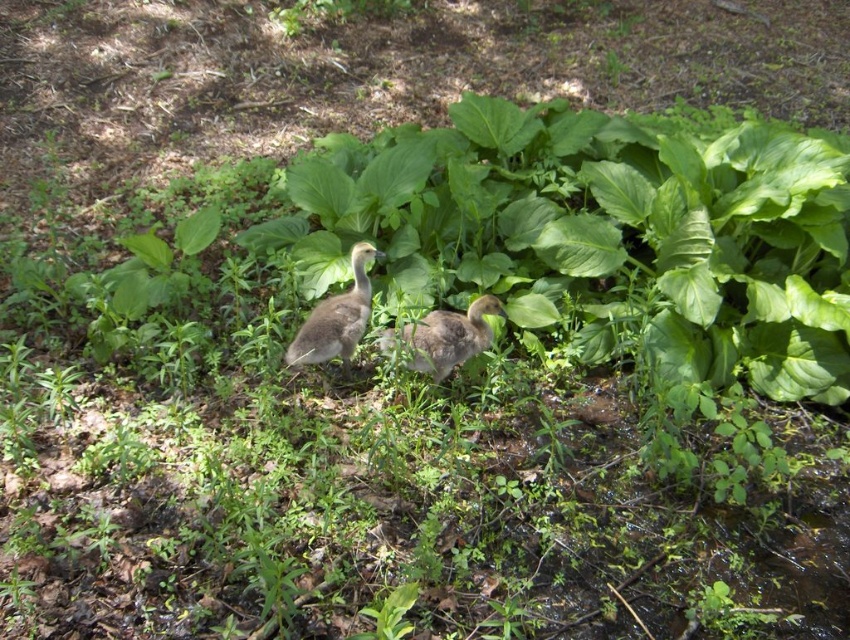
You are a nature photographer observing two ducklings in a forest. You notice the gray downy duckling at center and the brown downy duckling at center. Which duckling has a more slender body shape?

The gray downy duckling at center is thinner than the brown downy duckling at center, so it has a more slender body shape.

You are a wildlife photographer observing two ducklings in a forest. You notice the gray downy duckling at center and the brown downy duckling at center. Which duckling is taller?

The gray downy duckling at center is taller than the brown downy duckling at center according to the description.

You are a photographer trying to capture a clear photo of both the gray downy duckling at center and the brown downy duckling at center. Which duckling will appear closer to the camera in the photo?

The gray downy duckling at center will appear closer to the camera in the photo because it is positioned further to the viewer than the brown downy duckling at center.